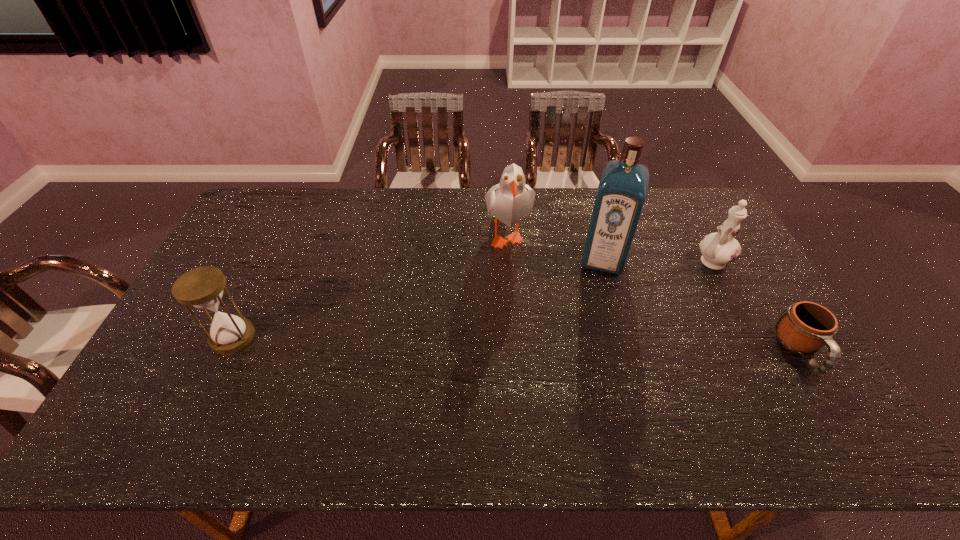
Locate an element on the screen. The image size is (960, 540). the leftmost object is located at coordinates (202, 287).

Find the location of a particular element. This screenshot has height=540, width=960. the shortest object is located at coordinates (804, 327).

The height and width of the screenshot is (540, 960). Identify the location of chinaware. (718, 249).

At what (x,y) coordinates should I click in order to perform the action: click on the tallest object. Please return your answer as a coordinate pair (x, y). The image size is (960, 540). Looking at the image, I should click on (621, 194).

I want to click on the third object from left to right, so click(621, 194).

You are a GUI agent. You are given a task and a screenshot of the screen. Output one action in this format:
    pyautogui.click(x=<x>, y=<y>)
    Task: Click on the second tallest object
    The width and height of the screenshot is (960, 540).
    Given the screenshot: What is the action you would take?
    pyautogui.click(x=510, y=201)

What are the coordinates of `the second object from left to right` in the screenshot? It's located at (510, 201).

Where is `vacant area situated on the right of the hourglass`? The height and width of the screenshot is (540, 960). vacant area situated on the right of the hourglass is located at coordinates (290, 337).

Image resolution: width=960 pixels, height=540 pixels. What are the coordinates of `free location located on the side of the mug with the handle` in the screenshot? It's located at (829, 399).

Where is `vacant area located 0.270m at the spout of the chinaware`? This screenshot has width=960, height=540. vacant area located 0.270m at the spout of the chinaware is located at coordinates (641, 307).